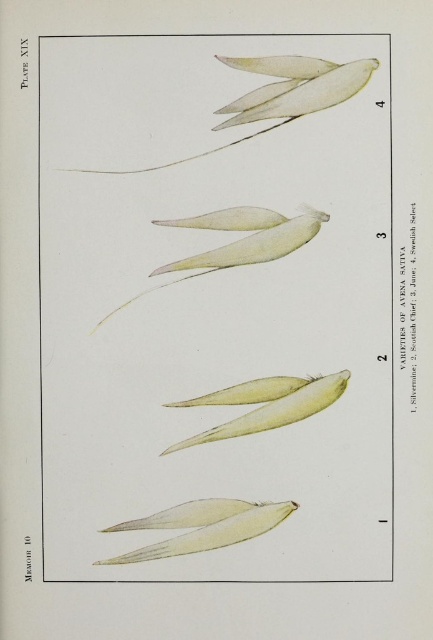
Question: Is translucent paper-like leaf at lower center behind light yellow matte seed at center?

Choices:
 (A) no
 (B) yes

Answer: (A)

Question: In this image, where is translucent paper-like leaf at lower center located relative to light yellow matte seed at center?

Choices:
 (A) above
 (B) below

Answer: (B)

Question: Which point is closer to the camera?

Choices:
 (A) translucent paper-like leaf at lower center
 (B) light yellow matte seed at center

Answer: (A)

Question: Which point is farther to the camera?

Choices:
 (A) light yellow matte seed at center
 (B) translucent paper-like leaf at lower center

Answer: (A)

Question: Can you confirm if translucent paper-like leaf at lower center is positioned to the right of light yellow matte seed at center?

Choices:
 (A) yes
 (B) no

Answer: (B)

Question: Which of the following is the closest to the observer?

Choices:
 (A) (252, 392)
 (B) (186, 515)

Answer: (B)